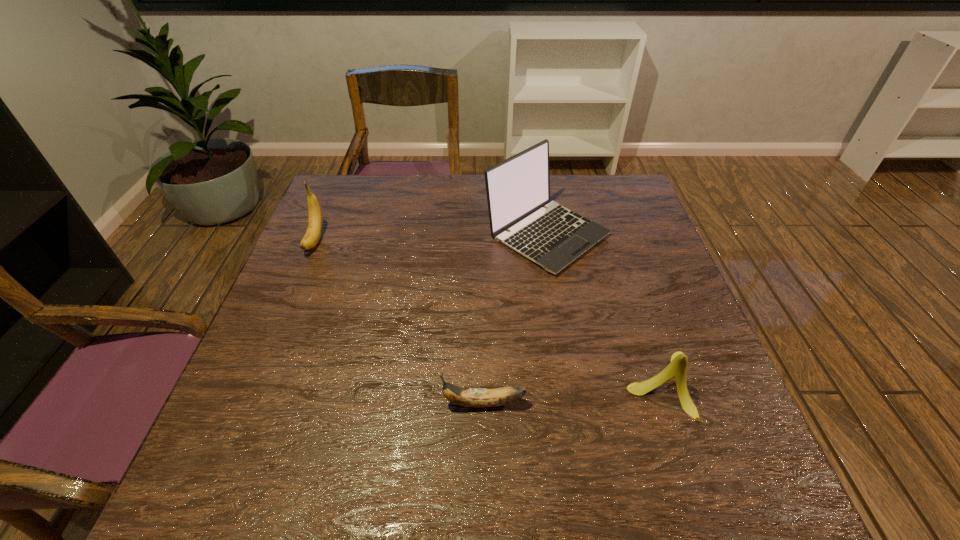
This screenshot has height=540, width=960. Identify the location of free space located on the peel of the shortest object. (369, 403).

The width and height of the screenshot is (960, 540). I want to click on vacant space located 0.210m on the peel of the shortest object, so click(333, 403).

Locate an element on the screen. The width and height of the screenshot is (960, 540). free region located on the peel of the shortest object is located at coordinates (282, 403).

What are the coordinates of `object that is positioned at the far edge` in the screenshot? It's located at (518, 188).

Identify the location of object situated at the left edge. (315, 221).

You are a GUI agent. You are given a task and a screenshot of the screen. Output one action in this format:
    pyautogui.click(x=<x>, y=<y>)
    Task: Click on the laptop_computer that is at the right edge
    Image resolution: width=960 pixels, height=540 pixels.
    Given the screenshot: What is the action you would take?
    pyautogui.click(x=518, y=188)

Find the location of a particular element. banana present at the right edge is located at coordinates (677, 368).

Find the location of a particular element. The image size is (960, 540). object that is at the far right corner is located at coordinates (518, 188).

The height and width of the screenshot is (540, 960). In the image, there is a desktop. Find the location of `vacant space at the far edge`. vacant space at the far edge is located at coordinates tap(458, 203).

Locate an element on the screen. The height and width of the screenshot is (540, 960). vacant space at the near edge is located at coordinates (610, 473).